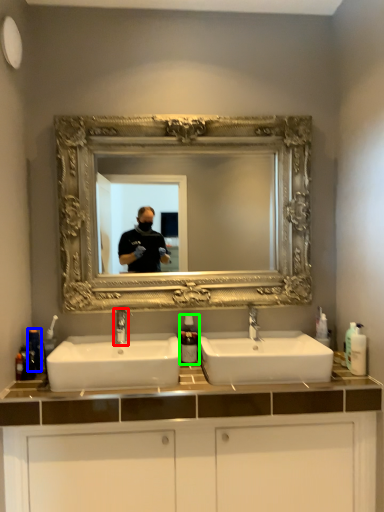
Question: Based on their relative distances, which object is nearer to tap (highlighted by a red box)? Choose from toiletry (highlighted by a blue box) and soap dispenser (highlighted by a green box).

Choices:
 (A) toiletry
 (B) soap dispenser

Answer: (B)